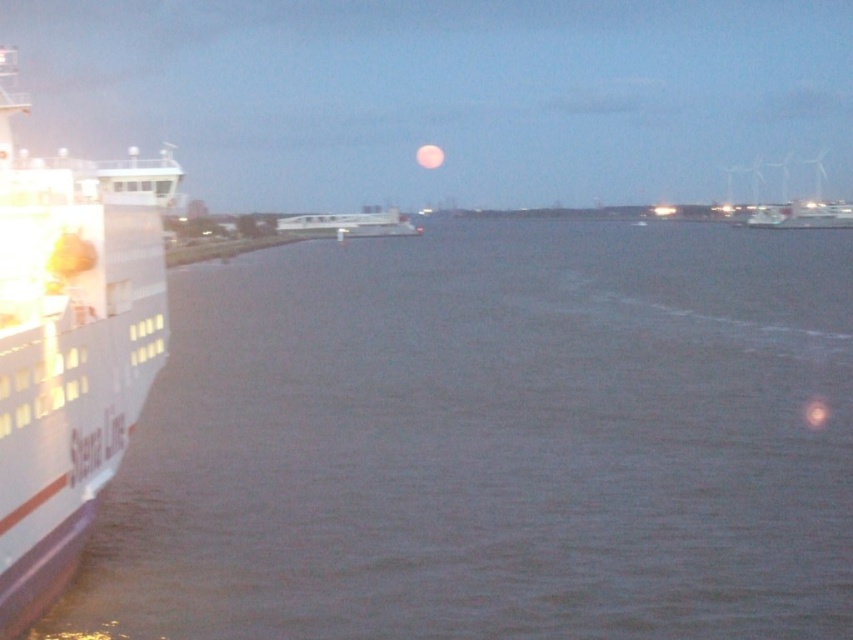
Question: Can you confirm if dark blue water at left is positioned below white matte boat at center?

Choices:
 (A) no
 (B) yes

Answer: (B)

Question: Which point appears farthest from the camera in this image?

Choices:
 (A) (395, 218)
 (B) (94, 618)
 (C) (7, 490)

Answer: (A)

Question: Which point is farther to the camera?

Choices:
 (A) dark blue water at left
 (B) white glossy cruise ship at left
 (C) white matte boat at center

Answer: (C)

Question: Can you confirm if white glossy cruise ship at left is positioned below white matte boat at center?

Choices:
 (A) no
 (B) yes

Answer: (A)

Question: Which object is positioned closest to the dark blue water at left?

Choices:
 (A) white glossy cruise ship at left
 (B) white matte boat at center

Answer: (A)

Question: Is dark blue water at left thinner than white glossy cruise ship at left?

Choices:
 (A) yes
 (B) no

Answer: (A)